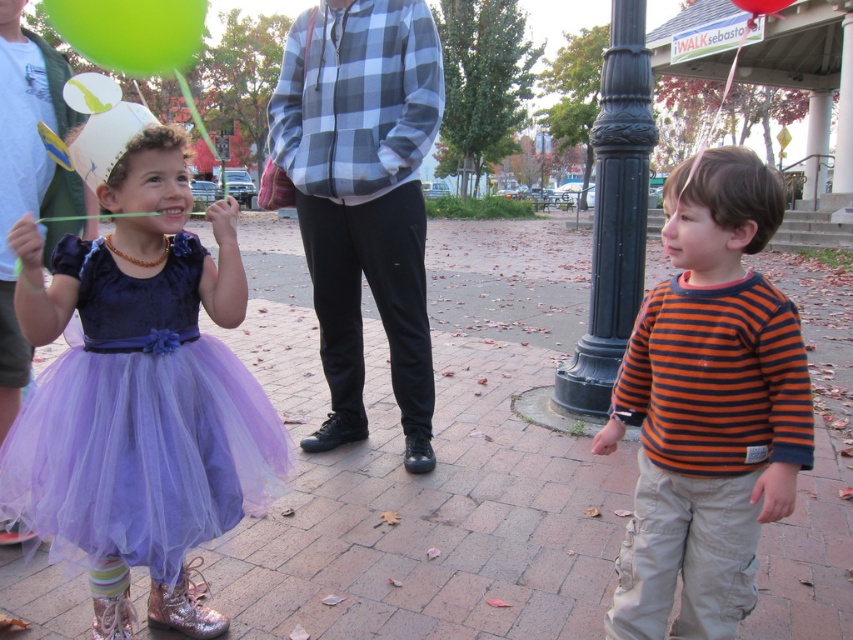
Question: Among these points, which one is nearest to the camera?

Choices:
 (A) (398, 385)
 (B) (624, 284)

Answer: (A)

Question: Can you confirm if lavender tulle dress at left is smaller than black cast iron pole at center?

Choices:
 (A) yes
 (B) no

Answer: (B)

Question: Which point appears closest to the camera in this image?

Choices:
 (A) pos(614,605)
 (B) pos(128,67)

Answer: (A)

Question: Among these objects, which one is nearest to the camera?

Choices:
 (A) checkered fabric hoodie at center
 (B) green rubber balloon at upper left

Answer: (A)

Question: Can you confirm if lavender tulle dress at left is bigger than green rubber balloon at upper left?

Choices:
 (A) no
 (B) yes

Answer: (A)

Question: Is the position of black cast iron pole at center more distant than that of matte green balloon at left?

Choices:
 (A) no
 (B) yes

Answer: (B)